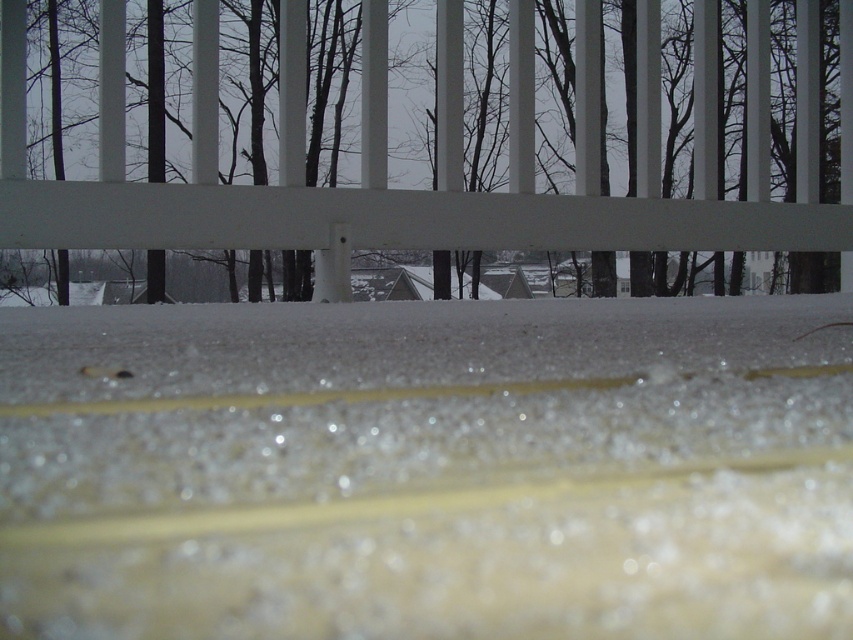
Question: Which point is farther from the camera taking this photo?

Choices:
 (A) (178, 244)
 (B) (480, 572)

Answer: (A)

Question: Is translucent ice crystals at center to the left of brown wood tree at upper center from the viewer's perspective?

Choices:
 (A) yes
 (B) no

Answer: (A)

Question: Where is translucent ice crystals at center located in relation to brown wood tree at upper center in the image?

Choices:
 (A) above
 (B) below

Answer: (B)

Question: Can you confirm if translucent ice crystals at center is positioned above brown wood tree at upper center?

Choices:
 (A) yes
 (B) no

Answer: (B)